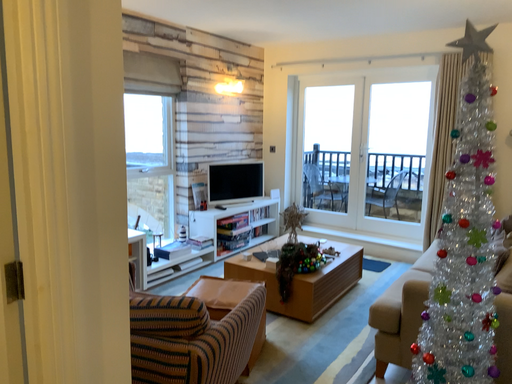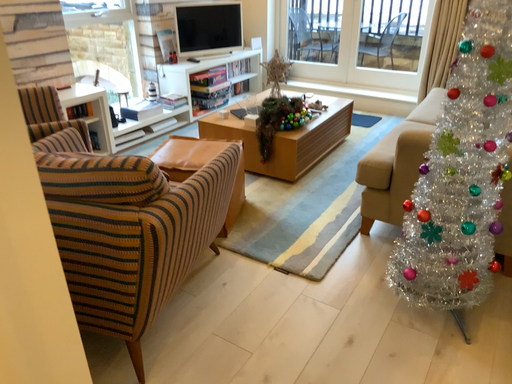
Question: How did the camera likely rotate when shooting the video?

Choices:
 (A) rotated upward
 (B) rotated downward

Answer: (B)